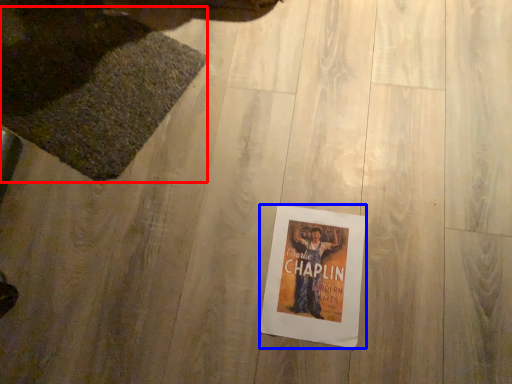
Question: Which object appears closest to the camera in this image, mat (highlighted by a red box) or poster (highlighted by a blue box)?

Choices:
 (A) mat
 (B) poster

Answer: (B)